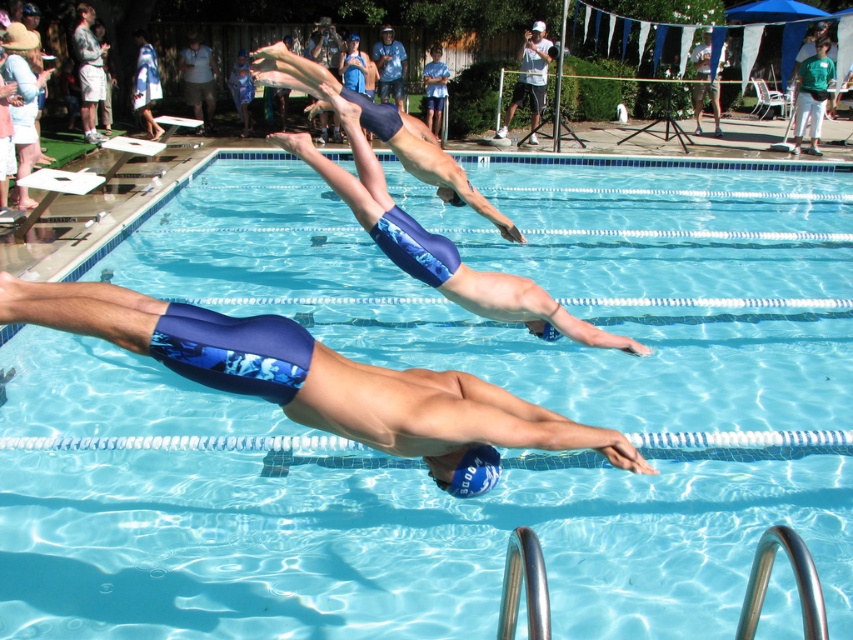
Can you confirm if green fabric shirt at upper right is shorter than white matte camera at upper center?

In fact, green fabric shirt at upper right may be taller than white matte camera at upper center.

Is point (825, 52) more distant than point (543, 97)?

Yes, it is behind point (543, 97).

Locate an element on the screen. Image resolution: width=853 pixels, height=640 pixels. green fabric shirt at upper right is located at coordinates (811, 96).

Between point (352, 410) and point (813, 99), which one is positioned in front?

Point (352, 410) is in front.

Can you confirm if blue neoprene swim cap at center is taller than green fabric shirt at upper right?

In fact, blue neoprene swim cap at center may be shorter than green fabric shirt at upper right.

Does point (148, 349) lie behind point (795, 124)?

No, (148, 349) is in front of (795, 124).

Where is `blue neoprene swim cap at center`? The height and width of the screenshot is (640, 853). blue neoprene swim cap at center is located at coordinates (318, 380).

Can you confirm if green fabric shirt at upper right is thinner than blue fabric shorts at center?

Incorrect, green fabric shirt at upper right's width is not less than blue fabric shorts at center's.

Locate an element on the screen. The width and height of the screenshot is (853, 640). green fabric shirt at upper right is located at coordinates (811, 96).

At what (x,y) coordinates should I click in order to perform the action: click on green fabric shirt at upper right. Please return your answer as a coordinate pair (x, y). Looking at the image, I should click on (811, 96).